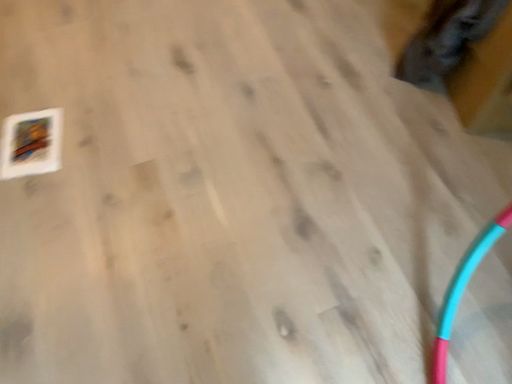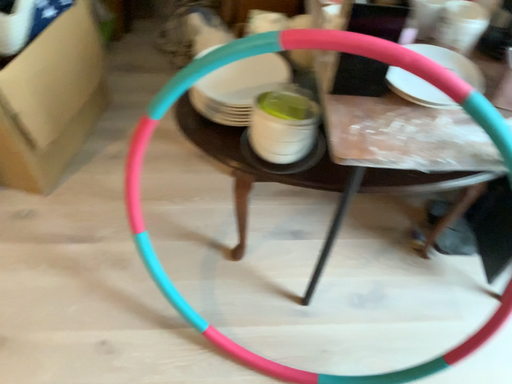
Question: Which way did the camera rotate in the video?

Choices:
 (A) rotated left
 (B) rotated right

Answer: (B)